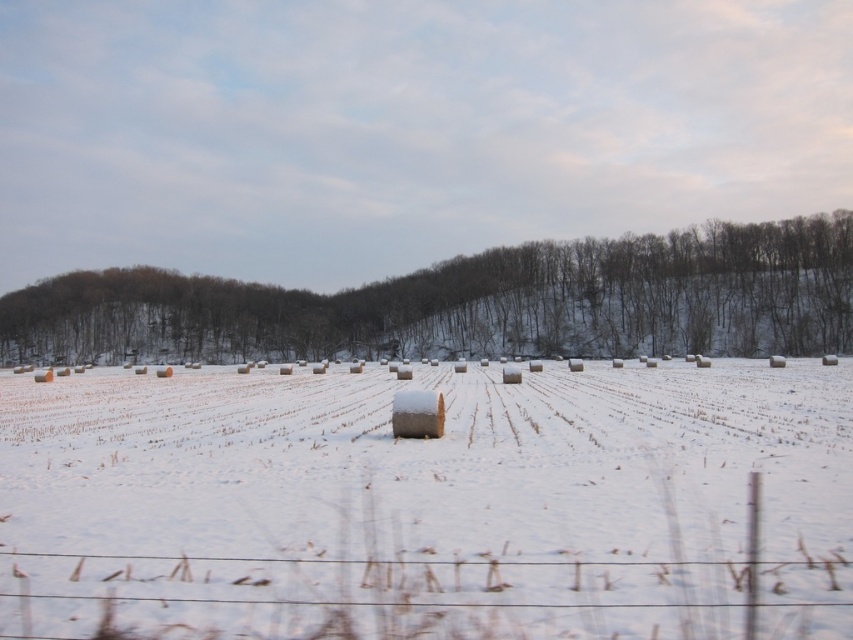
Question: Is snow-covered hay bale at center bigger than brown textured tree at center?

Choices:
 (A) no
 (B) yes

Answer: (A)

Question: Can you confirm if snow-covered hay bale at center is thinner than brown textured tree at center?

Choices:
 (A) no
 (B) yes

Answer: (B)

Question: Does snow-covered hay bale at center appear on the left side of brown textured tree at center?

Choices:
 (A) yes
 (B) no

Answer: (B)

Question: Which point appears closest to the camera in this image?

Choices:
 (A) (364, 548)
 (B) (657, 289)

Answer: (A)